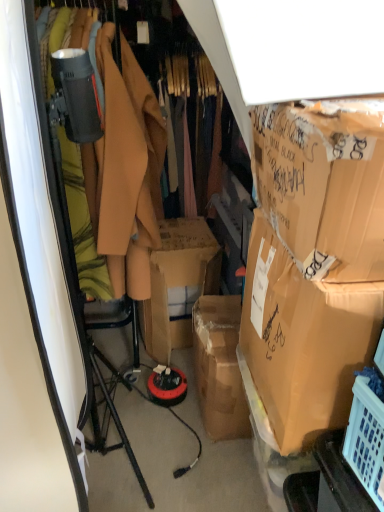
Question: Is brown cardboard box at right, the first box positioned from the bottom, shorter than brown cardboard box at right, acting as the second box starting from the bottom?

Choices:
 (A) yes
 (B) no

Answer: (B)

Question: Can you confirm if brown cardboard box at right, which is counted as the second box, starting from the top, is thinner than brown cardboard box at right, acting as the second box starting from the bottom?

Choices:
 (A) yes
 (B) no

Answer: (B)

Question: Does brown cardboard box at right, the first box positioned from the bottom, have a smaller size compared to brown cardboard box at right, placed as the first box when sorted from top to bottom?

Choices:
 (A) yes
 (B) no

Answer: (B)

Question: Can you confirm if brown cardboard box at right, which is counted as the second box, starting from the top, is positioned to the left of brown cardboard box at right, placed as the first box when sorted from top to bottom?

Choices:
 (A) no
 (B) yes

Answer: (A)

Question: Is brown cardboard box at right, which is counted as the second box, starting from the top, to the right of brown cardboard box at right, acting as the second box starting from the bottom, from the viewer's perspective?

Choices:
 (A) yes
 (B) no

Answer: (A)

Question: From a real-world perspective, does brown cardboard box at right, which is counted as the second box, starting from the top, sit lower than brown cardboard box at right, acting as the second box starting from the bottom?

Choices:
 (A) yes
 (B) no

Answer: (A)

Question: Is matte brown coat at center wider than brown cardboard box at right, placed as the first box when sorted from top to bottom?

Choices:
 (A) yes
 (B) no

Answer: (A)

Question: Is matte brown coat at center in contact with brown cardboard box at right, acting as the second box starting from the bottom?

Choices:
 (A) no
 (B) yes

Answer: (A)

Question: Is matte brown coat at center aimed at brown cardboard box at right, acting as the second box starting from the bottom?

Choices:
 (A) no
 (B) yes

Answer: (B)

Question: From a real-world perspective, is matte brown coat at center positioned under brown cardboard box at right, placed as the first box when sorted from top to bottom, based on gravity?

Choices:
 (A) no
 (B) yes

Answer: (B)

Question: Considering the relative sizes of matte brown coat at center and brown cardboard box at right, placed as the first box when sorted from top to bottom, in the image provided, is matte brown coat at center bigger than brown cardboard box at right, placed as the first box when sorted from top to bottom,?

Choices:
 (A) yes
 (B) no

Answer: (A)

Question: Is matte brown coat at center not inside brown cardboard box at right, placed as the first box when sorted from top to bottom?

Choices:
 (A) yes
 (B) no

Answer: (A)

Question: Considering the relative sizes of brown cardboard box at right, acting as the second box starting from the bottom, and matte brown coat at center in the image provided, is brown cardboard box at right, acting as the second box starting from the bottom, thinner than matte brown coat at center?

Choices:
 (A) yes
 (B) no

Answer: (A)